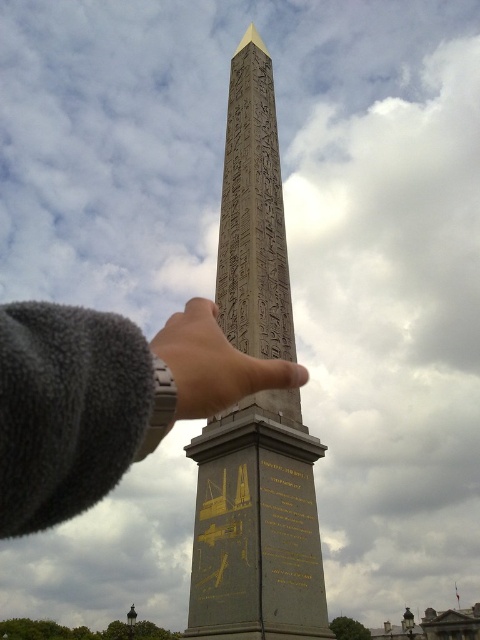
Question: Does gray polished stone obelisk at center have a smaller size compared to gray fleece finger at center?

Choices:
 (A) no
 (B) yes

Answer: (A)

Question: Which point appears farthest from the camera in this image?

Choices:
 (A) (264, 365)
 (B) (283, 401)
 (C) (284, 529)
 (D) (205, 413)

Answer: (B)

Question: Does gray fleece finger at center have a larger size compared to goldmaterial/textureinscription at center?

Choices:
 (A) yes
 (B) no

Answer: (A)

Question: Among these objects, which one is nearest to the camera?

Choices:
 (A) gray fleece finger at center
 (B) gray polished stone obelisk at center
 (C) goldmaterial/textureinscription at center

Answer: (A)

Question: Which of the following is the closest to the observer?

Choices:
 (A) click(308, 490)
 (B) click(14, 365)
 (C) click(235, 301)
 (D) click(191, 417)

Answer: (B)

Question: Is gray polished stone obelisk at center above goldmaterial/textureinscription at center?

Choices:
 (A) yes
 (B) no

Answer: (A)